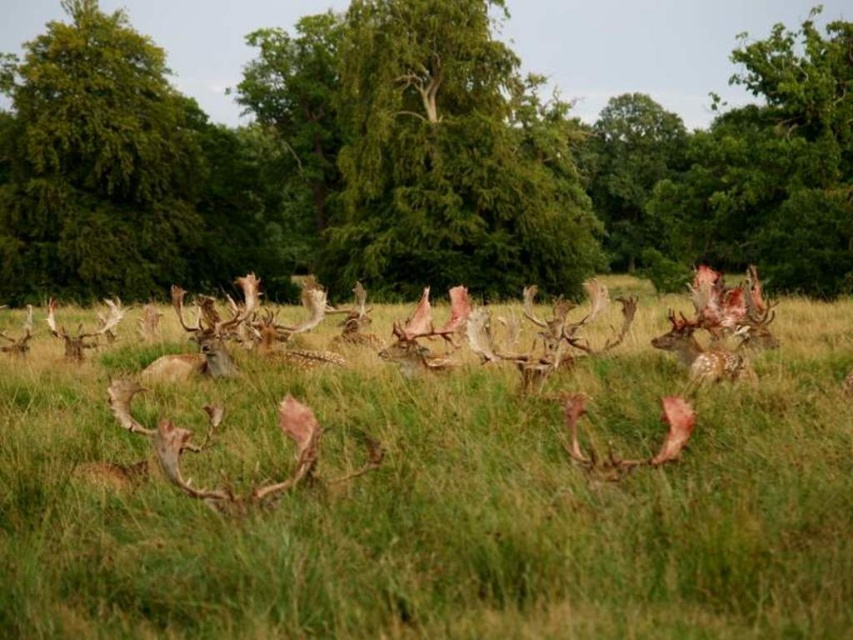
Question: Which is nearer to the fawn fur antlers at center?

Choices:
 (A) green leafy tree at center
 (B) spotted fur antlers at center
 (C) green leafy tree at upper left

Answer: (B)

Question: Is green leafy tree at upper left below spotted fur antlers at center?

Choices:
 (A) yes
 (B) no

Answer: (B)

Question: Among these points, which one is nearest to the camera?

Choices:
 (A) (560, 269)
 (B) (712, 380)

Answer: (B)

Question: Can you confirm if green leafy tree at upper left is thinner than spotted fur antlers at center?

Choices:
 (A) no
 (B) yes

Answer: (A)

Question: Which object is farther from the camera taking this photo?

Choices:
 (A) green leafy tree at upper left
 (B) spotted fur antlers at center

Answer: (A)

Question: Does fawn fur antlers at center have a smaller size compared to green leafy tree at center?

Choices:
 (A) yes
 (B) no

Answer: (A)